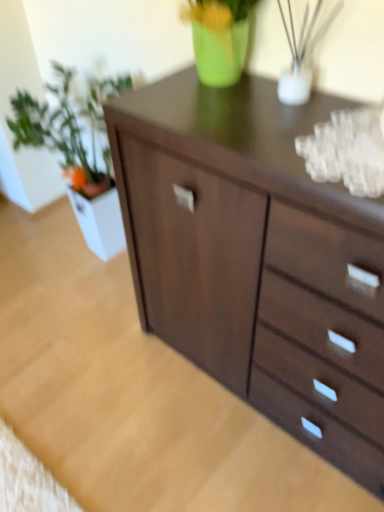
Question: Is green matte plant at left oriented away from dark wood chest of drawers at center?

Choices:
 (A) yes
 (B) no

Answer: (B)

Question: From a real-world perspective, is green matte plant at left under dark wood chest of drawers at center?

Choices:
 (A) yes
 (B) no

Answer: (B)

Question: Is green matte plant at left closer to the viewer compared to dark wood chest of drawers at center?

Choices:
 (A) yes
 (B) no

Answer: (B)

Question: Is green matte plant at left positioned behind dark wood chest of drawers at center?

Choices:
 (A) no
 (B) yes

Answer: (B)

Question: Could you tell me if green matte plant at left is turned towards dark wood chest of drawers at center?

Choices:
 (A) yes
 (B) no

Answer: (B)

Question: Does green matte plant at left have a greater height compared to dark wood chest of drawers at center?

Choices:
 (A) no
 (B) yes

Answer: (B)

Question: Is dark wood chest of drawers at center facing towards green matte plant at left?

Choices:
 (A) yes
 (B) no

Answer: (B)

Question: Is dark wood chest of drawers at center directly adjacent to green matte plant at left?

Choices:
 (A) yes
 (B) no

Answer: (B)

Question: Is dark wood chest of drawers at center not within green matte plant at left?

Choices:
 (A) yes
 (B) no

Answer: (A)

Question: Considering the relative sizes of dark wood chest of drawers at center and green matte plant at left in the image provided, is dark wood chest of drawers at center taller than green matte plant at left?

Choices:
 (A) yes
 (B) no

Answer: (B)

Question: Considering the relative sizes of dark wood chest of drawers at center and green matte plant at left in the image provided, is dark wood chest of drawers at center thinner than green matte plant at left?

Choices:
 (A) yes
 (B) no

Answer: (B)

Question: Would you say dark wood chest of drawers at center is a long distance from green matte plant at left?

Choices:
 (A) yes
 (B) no

Answer: (B)

Question: Looking at their shapes, would you say green matte plant at left is wider or thinner than dark wood chest of drawers at center?

Choices:
 (A) thin
 (B) wide

Answer: (A)